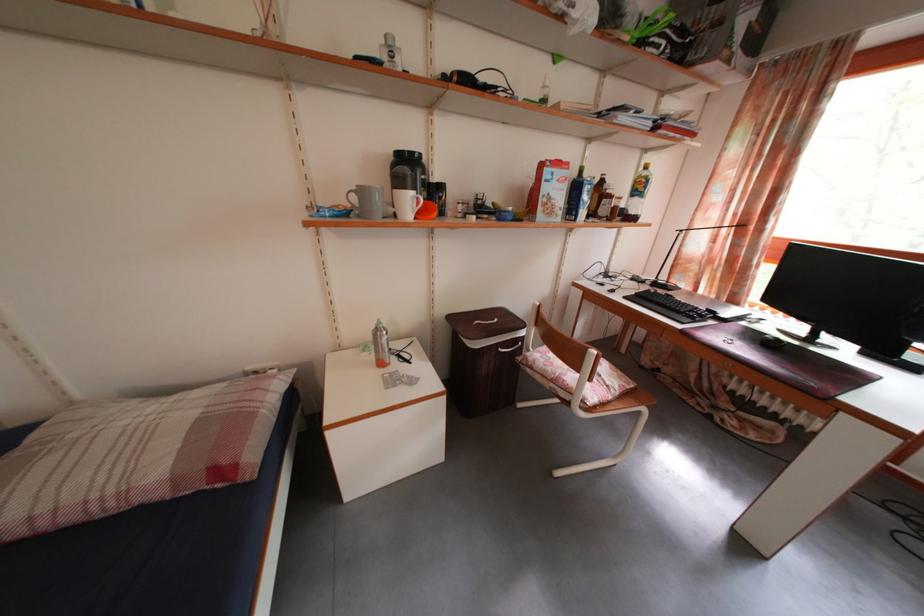
Find where to lift the black plastic container. Please return your answer as a coordinate pair (x, y).

(483, 359)